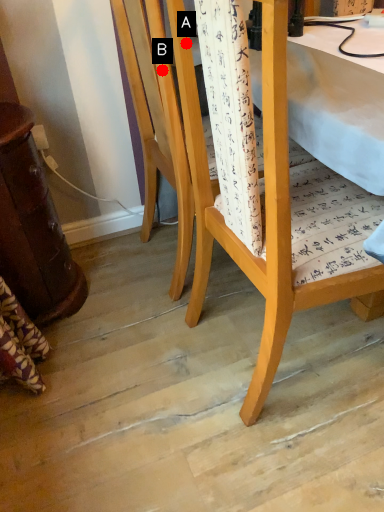
Question: Two points are circled on the image, labeled by A and B beside each circle. Which point is farther to the camera?

Choices:
 (A) A is further
 (B) B is further

Answer: (B)